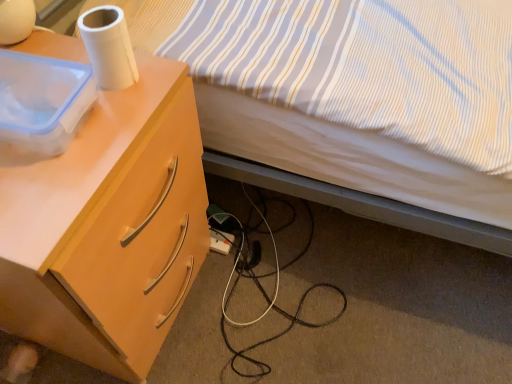
Find the location of `white plastic power outlet at lower center`. white plastic power outlet at lower center is located at coordinates (221, 241).

Locate an element on the screen. striped fabric bed at upper right is located at coordinates (349, 169).

This screenshot has width=512, height=384. What are the coordinates of `white plastic power outlet at lower center` in the screenshot? It's located at (x=221, y=241).

Is transparent plastic container at upper left positioned with its back to white plastic power outlet at lower center?

No, white plastic power outlet at lower center is not at the back of transparent plastic container at upper left.

From the image's perspective, between transparent plastic container at upper left and white plastic power outlet at lower center, which one is located above?

transparent plastic container at upper left.

Is the surface of transparent plastic container at upper left in direct contact with white plastic power outlet at lower center?

They are not placed beside each other.

Considering the sizes of objects transparent plastic container at upper left and white plastic power outlet at lower center in the image provided, who is thinner, transparent plastic container at upper left or white plastic power outlet at lower center?

white plastic power outlet at lower center.

Is white matte paper towel at upper left positioned beyond the bounds of striped fabric bed at upper right?

Absolutely, white matte paper towel at upper left is external to striped fabric bed at upper right.

Which object is positioned more to the right, white matte paper towel at upper left or striped fabric bed at upper right?

From the viewer's perspective, striped fabric bed at upper right appears more on the right side.

Considering the relative sizes of white matte paper towel at upper left and striped fabric bed at upper right in the image provided, is white matte paper towel at upper left thinner than striped fabric bed at upper right?

Yes, white matte paper towel at upper left is thinner than striped fabric bed at upper right.

Considering the points (91, 52) and (459, 195), which point is behind, point (91, 52) or point (459, 195)?

Point (459, 195)

Which point is more forward, (103, 69) or (126, 145)?

Point (126, 145)

How far apart are white matte paper towel at upper left and light wood/finish desk at left?

The distance of white matte paper towel at upper left from light wood/finish desk at left is 10.16 inches.

From a real-world perspective, between white matte paper towel at upper left and light wood/finish desk at left, who is vertically lower?

light wood/finish desk at left is physically lower.

Are white matte paper towel at upper left and light wood/finish desk at left making contact?

white matte paper towel at upper left and light wood/finish desk at left are clearly separated.

Does transparent plastic container at upper left appear on the left side of light wood/finish desk at left?

Incorrect, transparent plastic container at upper left is not on the left side of light wood/finish desk at left.

Consider the image. Is transparent plastic container at upper left placed right next to light wood/finish desk at left?

No, transparent plastic container at upper left is not with light wood/finish desk at left.

Is transparent plastic container at upper left taller than light wood/finish desk at left?

No.

Considering the positions of objects striped fabric bed at upper right and white plastic power outlet at lower center in the image provided, who is more to the right, striped fabric bed at upper right or white plastic power outlet at lower center?

Positioned to the right is striped fabric bed at upper right.

You are a GUI agent. You are given a task and a screenshot of the screen. Output one action in this format:
    pyautogui.click(x=<x>, y=<y>)
    Task: Click on the power outlet lying on the left of striped fabric bed at upper right
    The width and height of the screenshot is (512, 384).
    Given the screenshot: What is the action you would take?
    pyautogui.click(x=221, y=241)

Is striped fabric bed at upper right positioned with its back to white plastic power outlet at lower center?

striped fabric bed at upper right is not turned away from white plastic power outlet at lower center.

Considering the relative sizes of striped fabric bed at upper right and white plastic power outlet at lower center in the image provided, is striped fabric bed at upper right thinner than white plastic power outlet at lower center?

No, striped fabric bed at upper right is not thinner than white plastic power outlet at lower center.

What's the angular difference between white matte paper towel at upper left and transparent plastic container at upper left's facing directions?

The angle between the facing direction of white matte paper towel at upper left and the facing direction of transparent plastic container at upper left is 6.05 degrees.

Would you say white matte paper towel at upper left is a long distance from transparent plastic container at upper left?

No, white matte paper towel at upper left is in close proximity to transparent plastic container at upper left.

Which is correct: white matte paper towel at upper left is inside transparent plastic container at upper left, or outside of it?

white matte paper towel at upper left is outside transparent plastic container at upper left.

Find the location of `paper towel that is behind the transparent plastic container at upper left`. paper towel that is behind the transparent plastic container at upper left is located at coordinates (109, 47).

Between transparent plastic container at upper left and white matte paper towel at upper left, which one has larger size?

Bigger between the two is transparent plastic container at upper left.

Consider the image. Does transparent plastic container at upper left come in front of white matte paper towel at upper left?

Yes, transparent plastic container at upper left is closer to the viewer.

How far apart are transparent plastic container at upper left and white matte paper towel at upper left?

transparent plastic container at upper left is 3.20 inches from white matte paper towel at upper left.

Can white matte paper towel at upper left be found inside transparent plastic container at upper left?

Actually, white matte paper towel at upper left is outside transparent plastic container at upper left.

There is a white plastic power outlet at lower center. At what (x,y) coordinates should I click in order to perform the action: click on box above it (from a real-world perspective). Please return your answer as a coordinate pair (x, y). The image size is (512, 384). Looking at the image, I should click on (42, 100).

The width and height of the screenshot is (512, 384). I want to click on bed above the white matte paper towel at upper left (from the image's perspective), so click(x=349, y=169).

Which object lies nearer to the anchor point light wood/finish desk at left, white matte paper towel at upper left or transparent plastic container at upper left?

transparent plastic container at upper left lies closer to light wood/finish desk at left than the other object.

Estimate the real-world distances between objects in this image. Which object is closer to white matte paper towel at upper left, white plastic power outlet at lower center or transparent plastic container at upper left?

transparent plastic container at upper left is positioned closer to the anchor white matte paper towel at upper left.

From the image, which object appears to be nearer to white matte paper towel at upper left, light wood/finish desk at left or transparent plastic container at upper left?

transparent plastic container at upper left is closer to white matte paper towel at upper left.

Looking at the image, which one is located closer to white plastic power outlet at lower center, light wood/finish desk at left or transparent plastic container at upper left?

Among the two, light wood/finish desk at left is located nearer to white plastic power outlet at lower center.

From the image, which object appears to be farther from striped fabric bed at upper right, white matte paper towel at upper left or transparent plastic container at upper left?

Among the two, transparent plastic container at upper left is located further to striped fabric bed at upper right.

Considering their positions, is light wood/finish desk at left positioned closer to white matte paper towel at upper left than white plastic power outlet at lower center?

light wood/finish desk at left lies closer to white matte paper towel at upper left than the other object.

Based on their spatial positions, is striped fabric bed at upper right or white matte paper towel at upper left further from transparent plastic container at upper left?

The object further to transparent plastic container at upper left is striped fabric bed at upper right.

Based on their spatial positions, is white plastic power outlet at lower center or light wood/finish desk at left closer to white matte paper towel at upper left?

light wood/finish desk at left.

Find the location of a particular element. paper towel located between light wood/finish desk at left and white plastic power outlet at lower center in the depth direction is located at coordinates (109, 47).

Where is `box between striped fabric bed at upper right and white plastic power outlet at lower center along the z-axis`? box between striped fabric bed at upper right and white plastic power outlet at lower center along the z-axis is located at coordinates (42, 100).

You are a GUI agent. You are given a task and a screenshot of the screen. Output one action in this format:
    pyautogui.click(x=<x>, y=<y>)
    Task: Click on the paper towel located between striped fabric bed at upper right and white plastic power outlet at lower center in the depth direction
    
    Given the screenshot: What is the action you would take?
    pyautogui.click(x=109, y=47)

This screenshot has width=512, height=384. I want to click on paper towel positioned between transparent plastic container at upper left and white plastic power outlet at lower center from near to far, so click(109, 47).